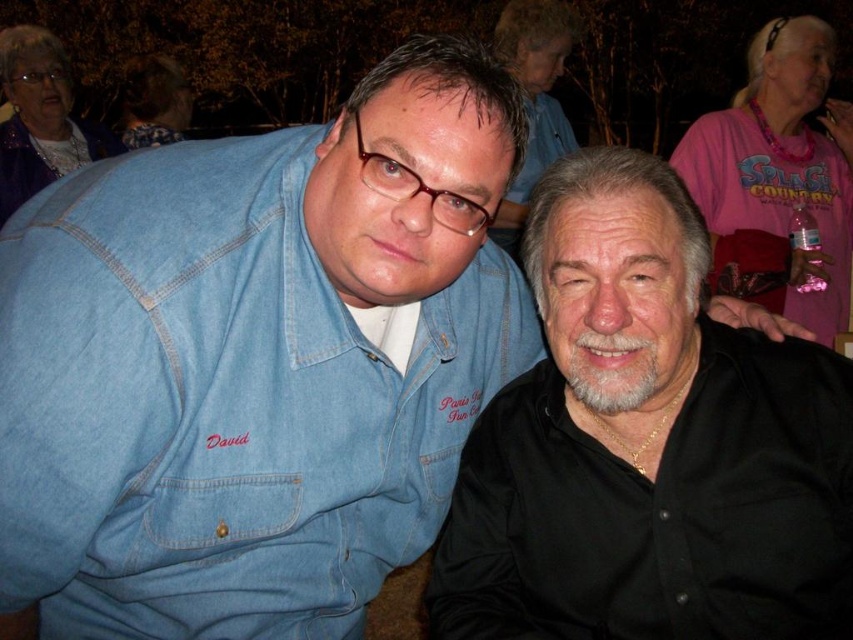
Question: Is matte purple jacket at upper left to the left of denim shirt at center from the viewer's perspective?

Choices:
 (A) yes
 (B) no

Answer: (A)

Question: Which point appears farthest from the camera in this image?

Choices:
 (A) (x=68, y=88)
 (B) (x=817, y=188)

Answer: (A)

Question: Estimate the real-world distances between objects in this image. Which object is farther from the denim shirt at center?

Choices:
 (A) matte pink shirt at upper center
 (B) black matte shirt at center
 (C) matte black hair at upper left
 (D) pink fabric shirt at upper right

Answer: (C)

Question: Which point is farther to the camera?

Choices:
 (A) (828, 449)
 (B) (148, 108)

Answer: (B)

Question: Is pink fabric shirt at upper right positioned behind matte pink shirt at upper center?

Choices:
 (A) no
 (B) yes

Answer: (A)

Question: Considering the relative positions of matte pink shirt at upper center and denim shirt at center in the image provided, where is matte pink shirt at upper center located with respect to denim shirt at center?

Choices:
 (A) right
 (B) left

Answer: (A)